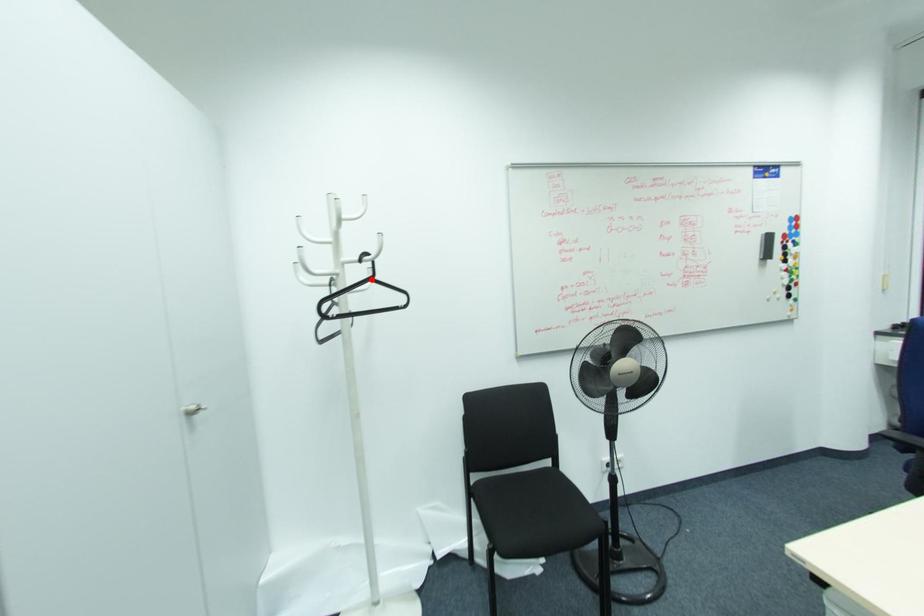
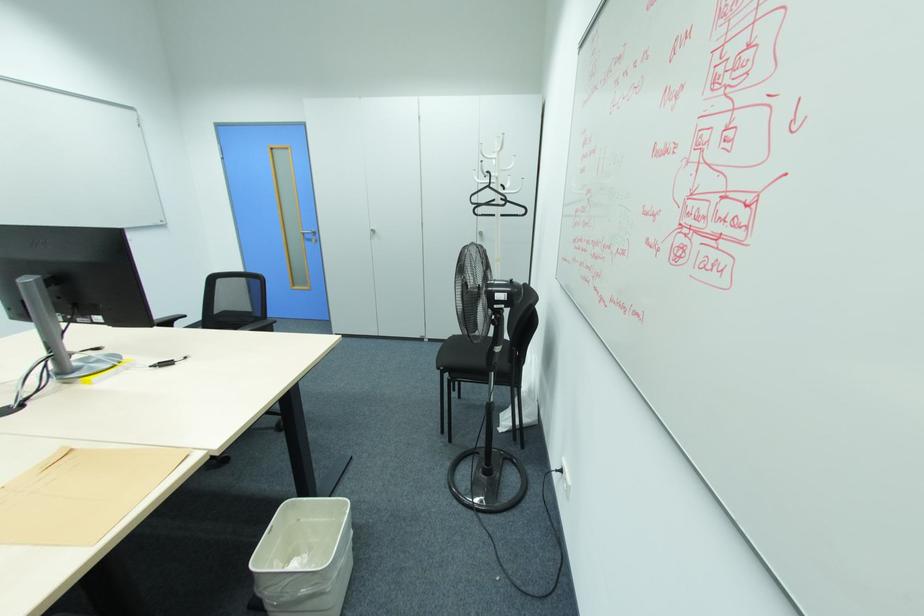
Question: A red point is marked in image1. In image2, is the corresponding 3D point closer to the camera or farther? Reply with the corresponding letter.

Choices:
 (A) The corresponding 3D point is closer.
 (B) The corresponding 3D point is farther.

Answer: (A)